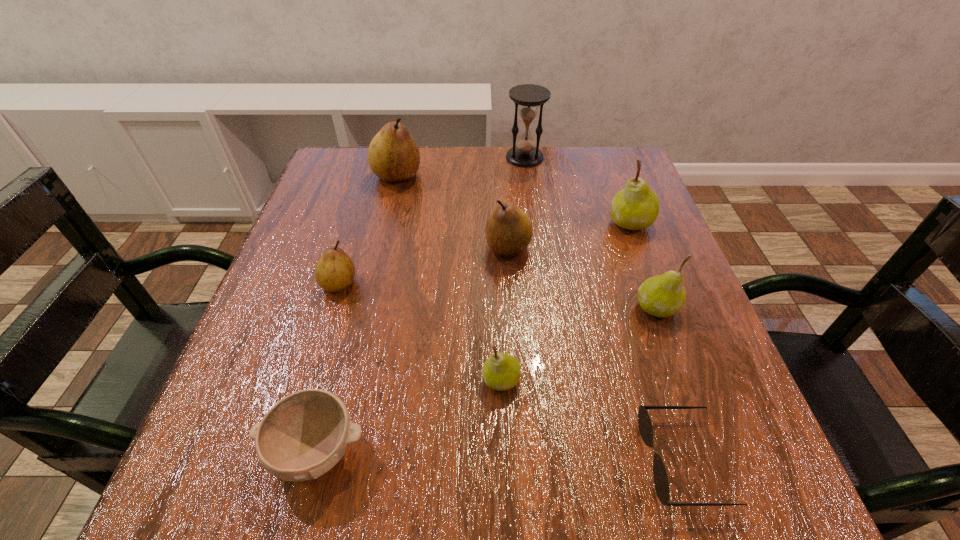
What are the coordinates of `the second shortest object` in the screenshot? It's located at (304, 435).

At what (x,y) coordinates should I click in order to perform the action: click on bowl. Please return your answer as a coordinate pair (x, y). Looking at the image, I should click on (304, 435).

I want to click on black sunglasses, so click(661, 483).

Locate an element on the screen. The width and height of the screenshot is (960, 540). the shortest object is located at coordinates (661, 483).

Find the location of a particular element. blank area located 0.060m on the right of the black hourglass is located at coordinates (566, 158).

Where is `free spot located 0.290m on the front of the farthest brown pear`? The height and width of the screenshot is (540, 960). free spot located 0.290m on the front of the farthest brown pear is located at coordinates (373, 276).

I want to click on free space located on the back of the biggest green pear, so click(x=620, y=196).

Where is `vacant space situated 0.100m on the back of the rightmost brown pear`? The image size is (960, 540). vacant space situated 0.100m on the back of the rightmost brown pear is located at coordinates (505, 204).

The width and height of the screenshot is (960, 540). What are the coordinates of `vacant space located on the back of the second farthest green pear` in the screenshot? It's located at point(622,213).

Find the location of `vacant space located 0.110m on the right of the nearest brown pear`. vacant space located 0.110m on the right of the nearest brown pear is located at coordinates (415, 284).